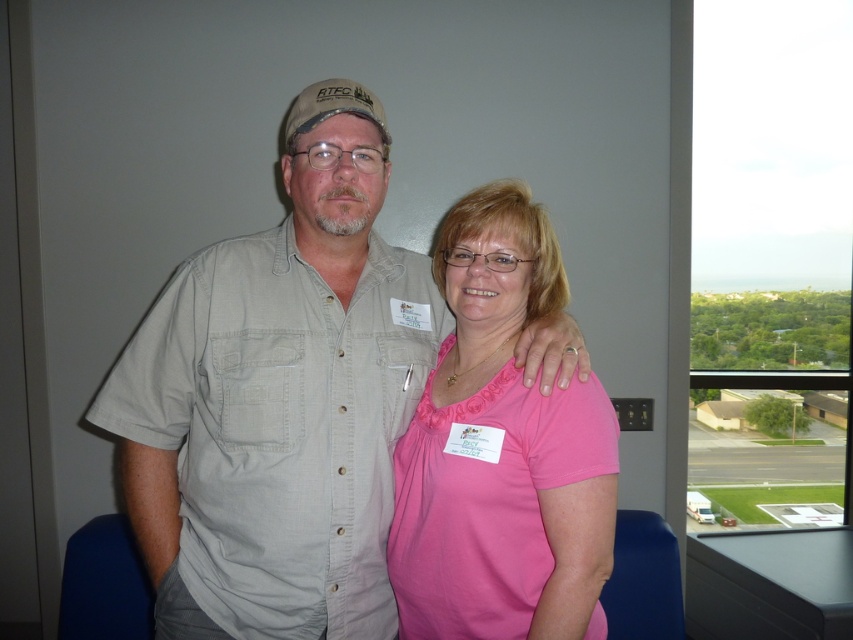
Does matte khaki shirt at center lie in front of pink matte shirt at center?

No.

Image resolution: width=853 pixels, height=640 pixels. What do you see at coordinates (280, 401) in the screenshot?
I see `matte khaki shirt at center` at bounding box center [280, 401].

The height and width of the screenshot is (640, 853). I want to click on matte khaki shirt at center, so click(280, 401).